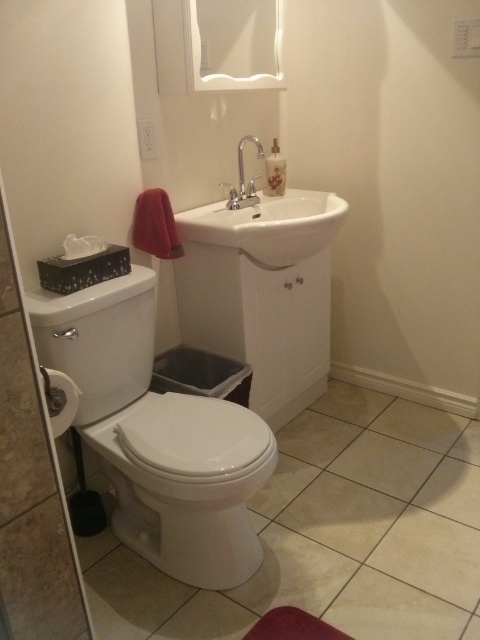
This screenshot has height=640, width=480. I want to click on white glossy tissue box at left, so click(x=31, y=486).

Does white glossy tissue box at left appear on the right side of white glossy sink at center?

No, white glossy tissue box at left is not to the right of white glossy sink at center.

Measure the distance between point [38,602] and camera.

The distance of point [38,602] from camera is 3.85 feet.

The height and width of the screenshot is (640, 480). In order to click on white glossy tissue box at left in this screenshot , I will do `click(31, 486)`.

Does white glossy toilet bowl at lower left have a larger size compared to white glossy sink at center?

Actually, white glossy toilet bowl at lower left might be smaller than white glossy sink at center.

Can you confirm if white glossy toilet bowl at lower left is taller than white glossy sink at center?

No, white glossy toilet bowl at lower left is not taller than white glossy sink at center.

The width and height of the screenshot is (480, 640). Describe the element at coordinates (187, 483) in the screenshot. I see `white glossy toilet bowl at lower left` at that location.

You are a GUI agent. You are given a task and a screenshot of the screen. Output one action in this format:
    pyautogui.click(x=<x>, y=<y>)
    Task: Click on the white glossy toilet bowl at lower left
    
    Given the screenshot: What is the action you would take?
    pyautogui.click(x=187, y=483)

Between white glossy toilet bowl at lower left and white glossy tissue box at left, which one is positioned lower?

white glossy toilet bowl at lower left is below.

Between white glossy toilet bowl at lower left and white glossy tissue box at left, which one appears on the right side from the viewer's perspective?

Positioned to the right is white glossy toilet bowl at lower left.

Locate an element on the screen. white glossy toilet bowl at lower left is located at coordinates (187, 483).